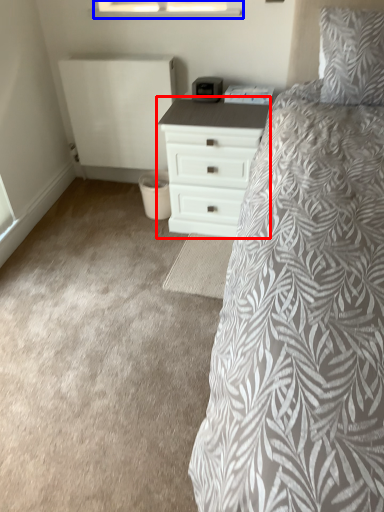
Question: Which of the following is the farthest to the observer, chest of drawers (highlighted by a red box) or window (highlighted by a blue box)?

Choices:
 (A) chest of drawers
 (B) window

Answer: (B)